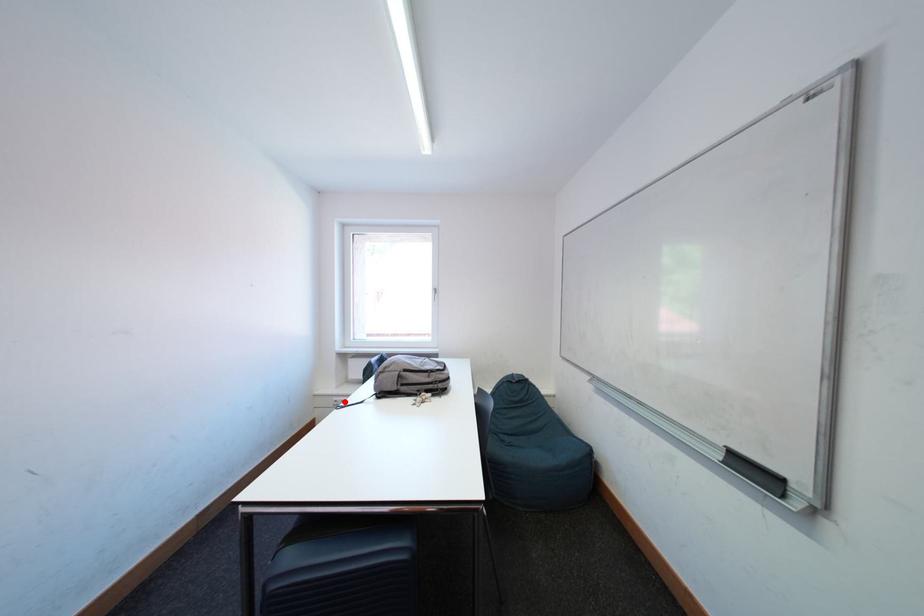
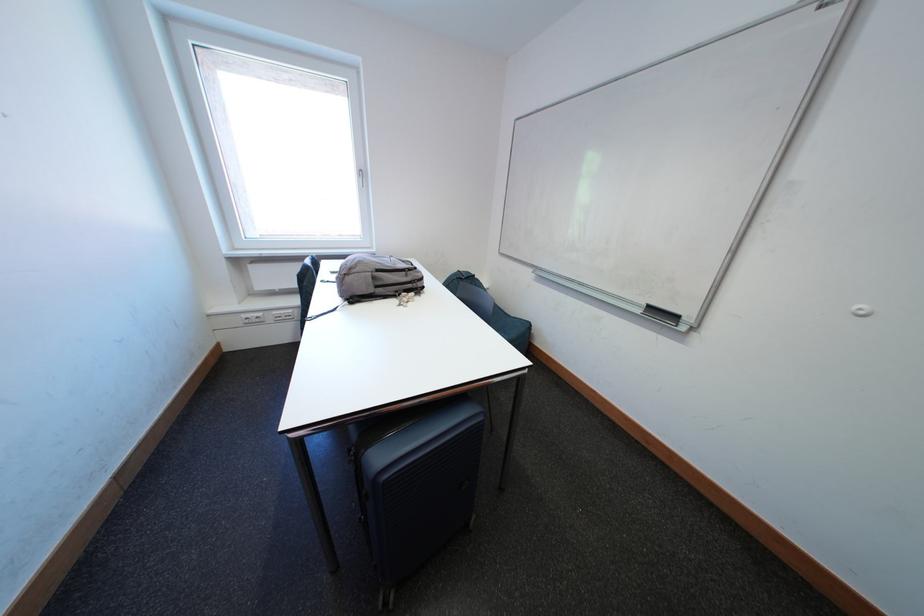
Question: I am providing you with two images of the same scene from different viewpoints. A red point is shown in image1. For the corresponding object point in image2, is it positioned nearer or farther from the camera?

Choices:
 (A) Nearer
 (B) Farther

Answer: (A)